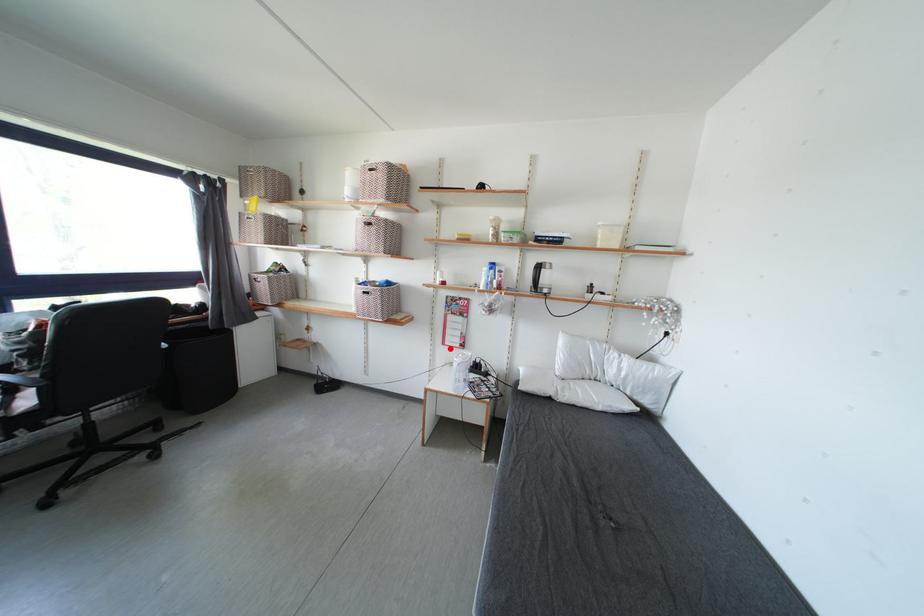
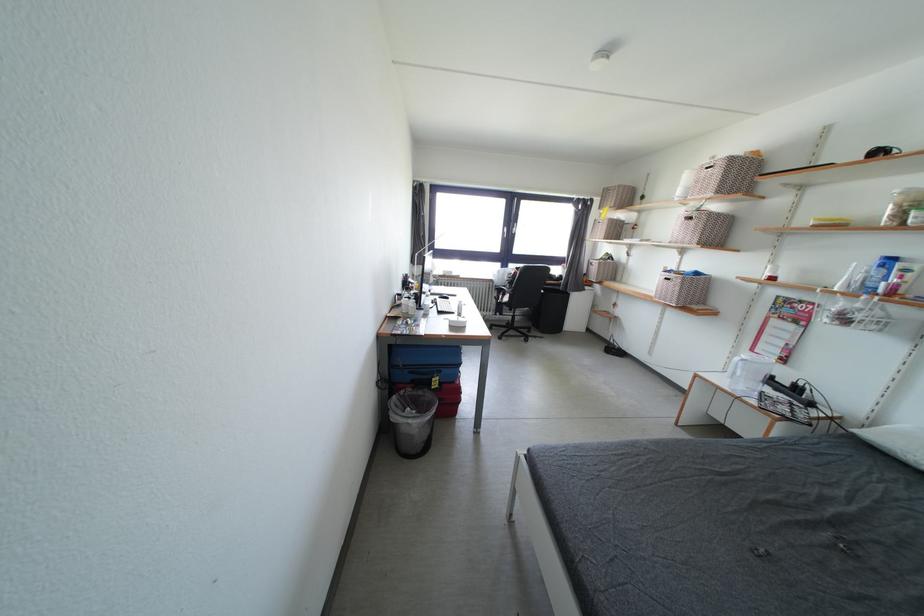
Question: I am providing you with two images of the same scene from different viewpoints. Given a red point in image1, look at the same physical point in image2. Is it:

Choices:
 (A) Closer to the viewpoint
 (B) Farther from the viewpoint

Answer: (A)